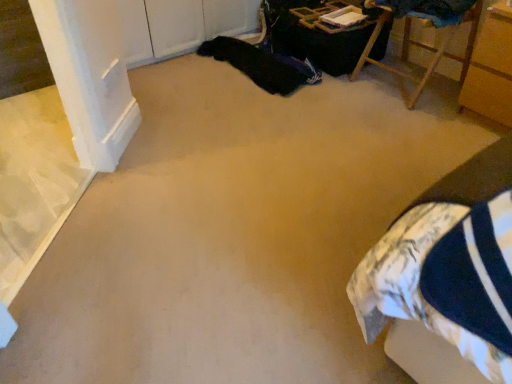
Find the location of a particular element. Image resolution: width=512 pixels, height=384 pixels. free space on the front side of wooden chair at upper right, the second furniture in the right-to-left sequence is located at coordinates (415, 127).